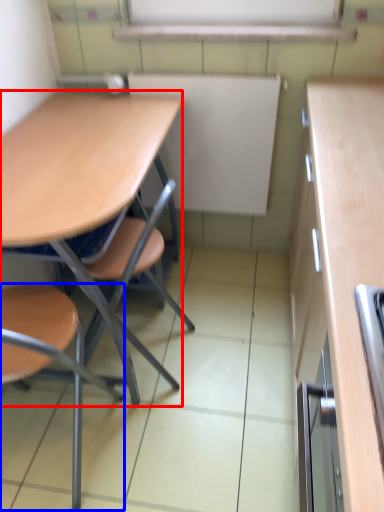
Question: Which point is closer to the camera, desk (highlighted by a red box) or chair (highlighted by a blue box)?

Choices:
 (A) desk
 (B) chair

Answer: (B)